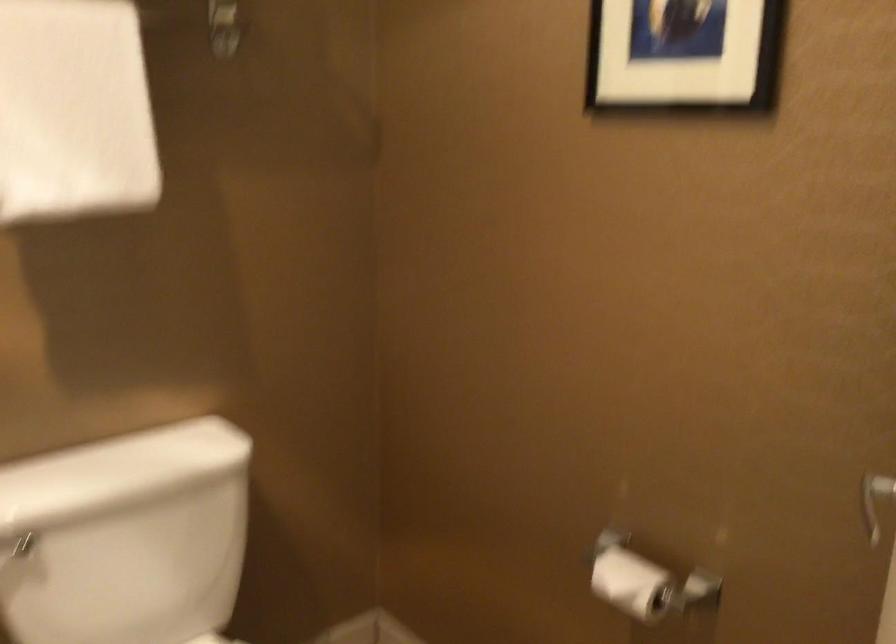
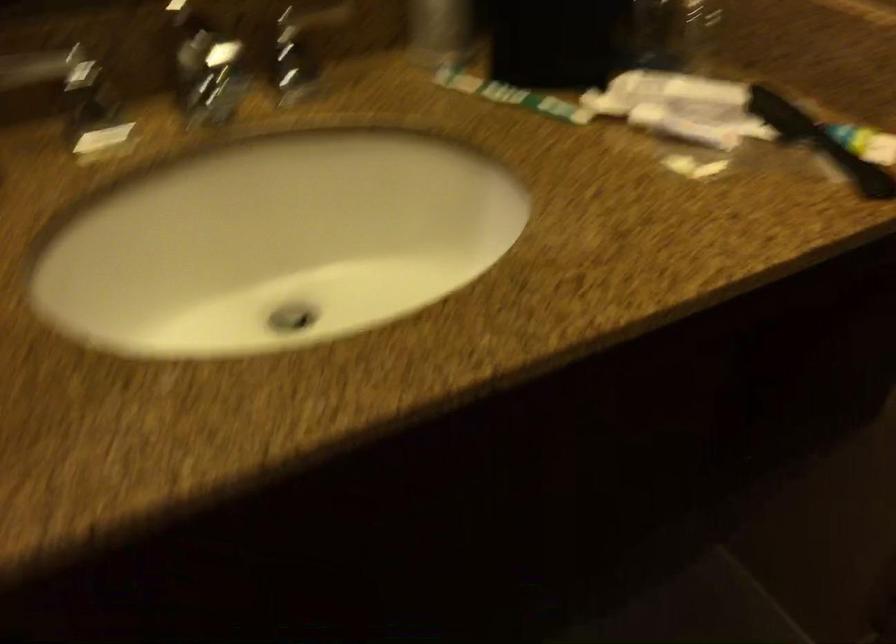
The first image is from the beginning of the video and the second image is from the end. How did the camera likely rotate when shooting the video?

The rotation direction of the camera is right-down.